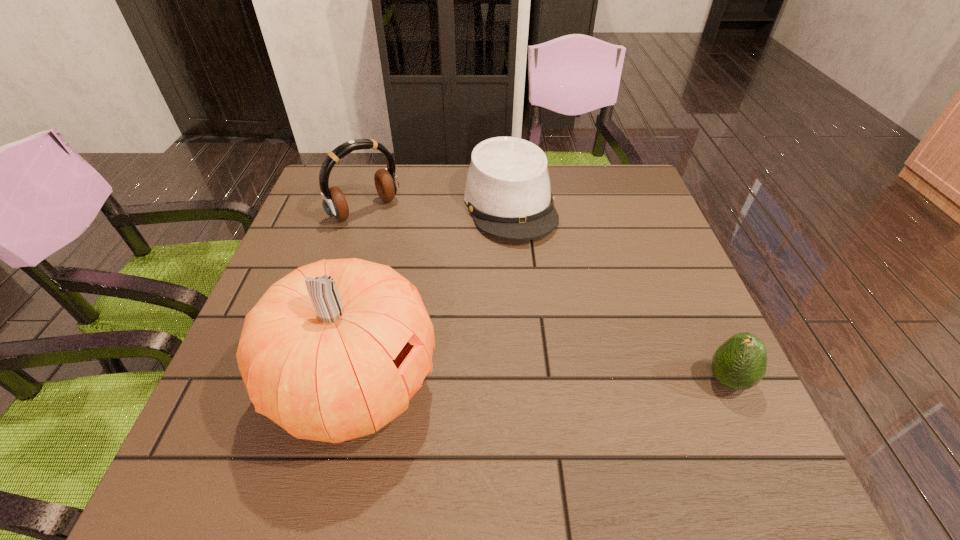
This screenshot has height=540, width=960. Identify the location of free space located 0.350m on the front-facing side of the hat. (569, 363).

At what (x,y) coordinates should I click in order to perform the action: click on vacant space located 0.210m on the front-facing side of the hat. Please return your answer as a coordinate pair (x, y). The height and width of the screenshot is (540, 960). Looking at the image, I should click on (548, 309).

In order to click on headset at the far edge in this screenshot , I will do `click(334, 202)`.

Locate an element on the screen. The height and width of the screenshot is (540, 960). hat that is positioned at the far edge is located at coordinates (507, 191).

What are the coordinates of `pumpkin located at the near edge` in the screenshot? It's located at (333, 351).

At what (x,y) coordinates should I click in order to perform the action: click on avocado located in the near edge section of the desktop. Please return your answer as a coordinate pair (x, y). This screenshot has width=960, height=540. Looking at the image, I should click on (740, 363).

Find the location of `pumpkin located at the left edge`. pumpkin located at the left edge is located at coordinates (333, 351).

Where is `headset positioned at the left edge`? The height and width of the screenshot is (540, 960). headset positioned at the left edge is located at coordinates (334, 202).

I want to click on object that is positioned at the right edge, so click(x=740, y=363).

Find the location of a particular element. This screenshot has width=960, height=540. object located at the far left corner is located at coordinates click(334, 202).